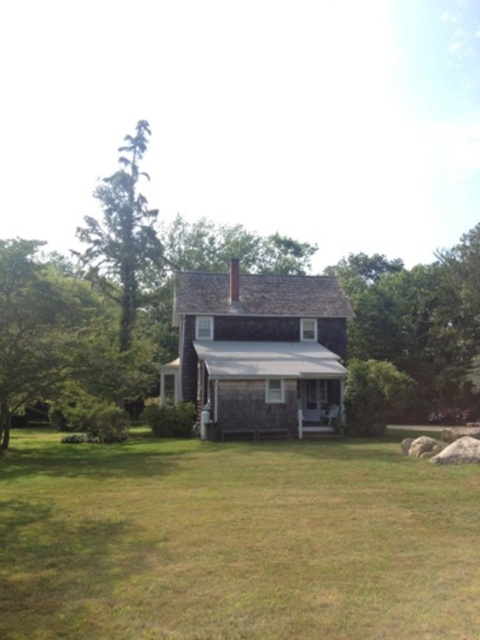
You are standing in front of the house and want to walk towards the green leafy tree at left and the green textured tree at left. Which tree will you reach first?

You will reach the green leafy tree at left first because it is closer to the viewer than the green textured tree at left.

You are standing in front of the house and notice two points marked in the scene. The first point is at coordinate point(12,381) and the second is at point(155,262). Which point is closer to you?

Point(12,381) is closer to the viewer than point(155,262).